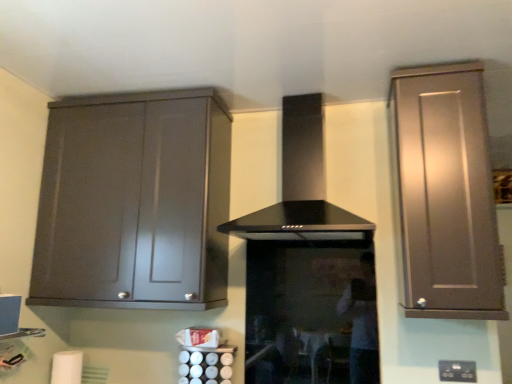
Question: Is black plastic electric outlet at lower right positioned behind satin brown cabinet at right, which is the 1th cabinetry in right-to-left order?

Choices:
 (A) yes
 (B) no

Answer: (A)

Question: Is black plastic electric outlet at lower right to the left of satin brown cabinet at right, which is the 1th cabinetry in right-to-left order, from the viewer's perspective?

Choices:
 (A) yes
 (B) no

Answer: (B)

Question: Is satin brown cabinet at right, which is the 1th cabinetry in right-to-left order, a part of black plastic electric outlet at lower right?

Choices:
 (A) no
 (B) yes

Answer: (A)

Question: Can you confirm if black plastic electric outlet at lower right is thinner than satin brown cabinet at right, which is the 1th cabinetry in right-to-left order?

Choices:
 (A) yes
 (B) no

Answer: (A)

Question: From a real-world perspective, is black plastic electric outlet at lower right on satin brown cabinet at right, which is the 1th cabinetry in right-to-left order?

Choices:
 (A) no
 (B) yes

Answer: (A)

Question: Does black plastic electric outlet at lower right appear on the right side of satin brown cabinet at right, placed as the 2th cabinetry when sorted from left to right?

Choices:
 (A) yes
 (B) no

Answer: (A)

Question: Does satin brown cabinet at right, placed as the 2th cabinetry when sorted from left to right, have a larger size compared to satin silver canisters at lower center?

Choices:
 (A) no
 (B) yes

Answer: (B)

Question: Is the surface of satin brown cabinet at right, which is the 1th cabinetry in right-to-left order, in direct contact with satin silver canisters at lower center?

Choices:
 (A) yes
 (B) no

Answer: (B)

Question: Considering the relative sizes of satin brown cabinet at right, placed as the 2th cabinetry when sorted from left to right, and satin silver canisters at lower center in the image provided, is satin brown cabinet at right, placed as the 2th cabinetry when sorted from left to right, thinner than satin silver canisters at lower center?

Choices:
 (A) yes
 (B) no

Answer: (B)

Question: Considering the relative positions of satin brown cabinet at right, which is the 1th cabinetry in right-to-left order, and satin silver canisters at lower center in the image provided, is satin brown cabinet at right, which is the 1th cabinetry in right-to-left order, to the right of satin silver canisters at lower center from the viewer's perspective?

Choices:
 (A) no
 (B) yes

Answer: (B)

Question: Is the position of satin brown cabinet at right, which is the 1th cabinetry in right-to-left order, more distant than that of satin silver canisters at lower center?

Choices:
 (A) yes
 (B) no

Answer: (B)

Question: Considering the relative positions of satin brown cabinet at right, which is the 1th cabinetry in right-to-left order, and satin silver canisters at lower center in the image provided, is satin brown cabinet at right, which is the 1th cabinetry in right-to-left order, to the left of satin silver canisters at lower center from the viewer's perspective?

Choices:
 (A) no
 (B) yes

Answer: (A)

Question: From the image's perspective, would you say satin silver canisters at lower center is positioned over white matte toilet paper at lower left?

Choices:
 (A) no
 (B) yes

Answer: (B)